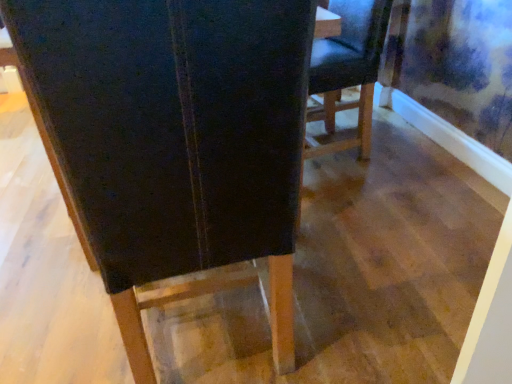
Where is `free region under black leather chair at center, which appears as the first chair when viewed from the left (from a real-world perspective)`? The image size is (512, 384). free region under black leather chair at center, which appears as the first chair when viewed from the left (from a real-world perspective) is located at coordinates (211, 338).